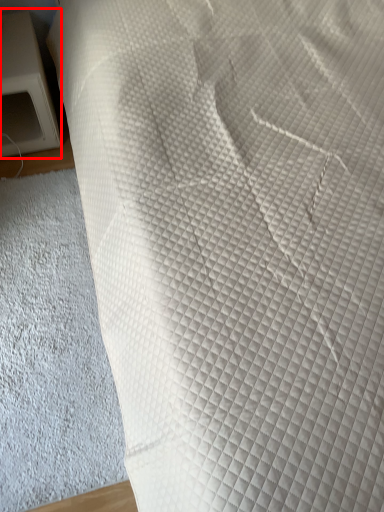
Question: In this image, where is furniture (annotated by the red box) located relative to sheet?

Choices:
 (A) right
 (B) left

Answer: (B)